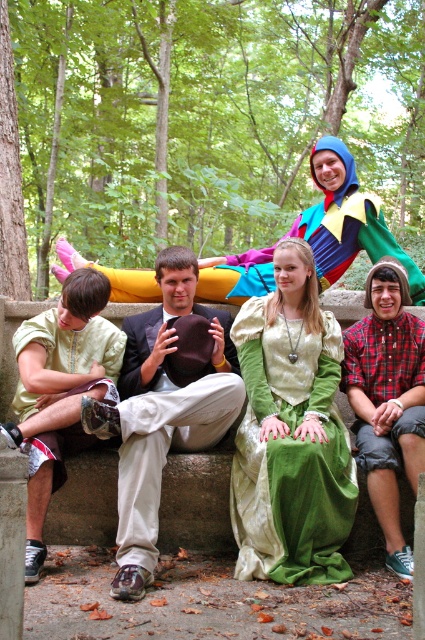
Question: Based on their relative distances, which object is nearer to the green linen dress at center?

Choices:
 (A) matte gold tunic at left
 (B) multicolored fabric figure at upper center
 (C) plaid shirt at center

Answer: (C)

Question: Which point is closer to the camera taking this photo?

Choices:
 (A) (333, 209)
 (B) (19, 342)
 (C) (393, 282)

Answer: (B)

Question: Which of these objects is positioned farthest from the plaid shirt at center?

Choices:
 (A) matte gold tunic at left
 (B) green linen dress at center

Answer: (A)

Question: Is green linen dress at center wider than multicolored fabric figure at upper center?

Choices:
 (A) no
 (B) yes

Answer: (A)

Question: Where is matte gold tunic at left located in relation to plaid shirt at center in the image?

Choices:
 (A) above
 (B) below

Answer: (B)

Question: Can you confirm if green linen dress at center is positioned below multicolored fabric figure at upper center?

Choices:
 (A) yes
 (B) no

Answer: (A)